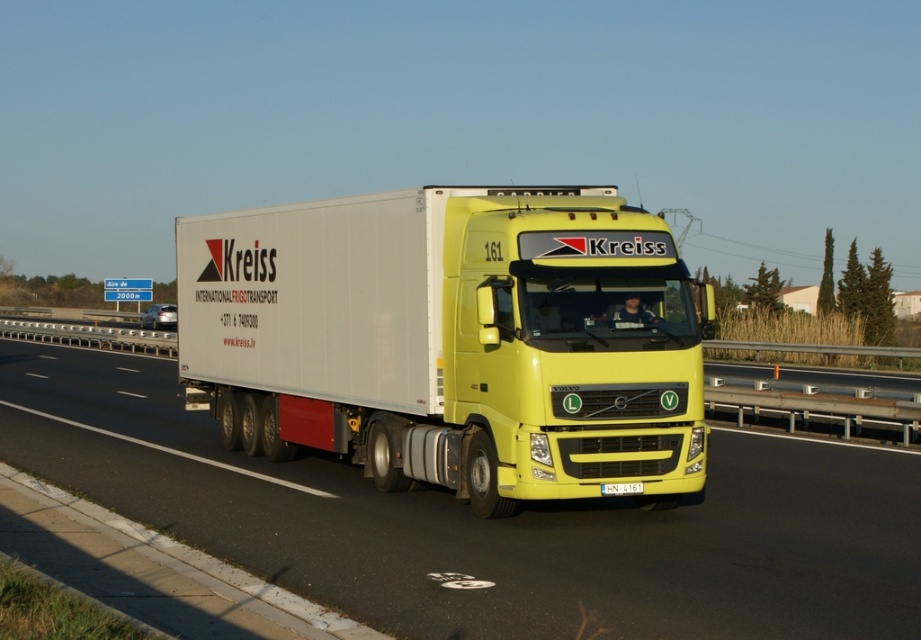
Is point (449, 280) farther from camera compared to point (659, 636)?

Yes, it is.

Who is positioned more to the right, matte white trailer truck at center or yellow glossy truck at center?

Positioned to the right is matte white trailer truck at center.

Which is in front, point (211, 272) or point (720, 632)?

Point (720, 632)

Image resolution: width=921 pixels, height=640 pixels. What are the coordinates of `matte white trailer truck at center` in the screenshot? It's located at click(x=452, y=339).

Does matte white trailer truck at center appear on the right side of yellow plastic license plate at center?

Yes, matte white trailer truck at center is to the right of yellow plastic license plate at center.

Based on the photo, is matte white trailer truck at center taller than yellow plastic license plate at center?

Yes.

Where is `matte white trailer truck at center`? This screenshot has width=921, height=640. matte white trailer truck at center is located at coordinates (452, 339).

Is yellow glossy truck at center smaller than yellow plastic license plate at center?

Actually, yellow glossy truck at center might be larger than yellow plastic license plate at center.

Which is behind, point (764, 531) or point (639, 488)?

Point (639, 488)

Locate an element on the screen. The image size is (921, 640). yellow glossy truck at center is located at coordinates (488, 524).